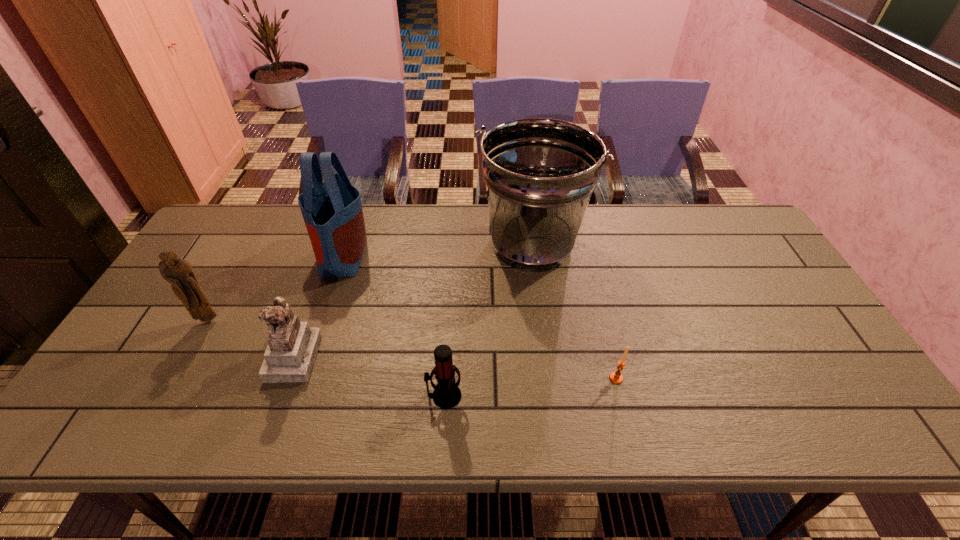
Where is `bucket`? bucket is located at coordinates (540, 173).

Image resolution: width=960 pixels, height=540 pixels. What are the coordinates of `handbag` in the screenshot? It's located at (332, 211).

Identify the location of the taller figurine. This screenshot has width=960, height=540. (178, 272).

Image resolution: width=960 pixels, height=540 pixels. I want to click on the third farthest object, so click(178, 272).

The image size is (960, 540). In order to click on the nearer figurine in this screenshot , I will do `click(292, 346)`.

Identify the location of the shorter figurine. (292, 346).

Find the location of `the second shortest object`. the second shortest object is located at coordinates (447, 394).

Where is `microphone`? This screenshot has height=540, width=960. microphone is located at coordinates (447, 394).

Where is `candle_holder`? The image size is (960, 540). candle_holder is located at coordinates (615, 377).

Where is `free region located on the left of the bucket`? The image size is (960, 540). free region located on the left of the bucket is located at coordinates (367, 245).